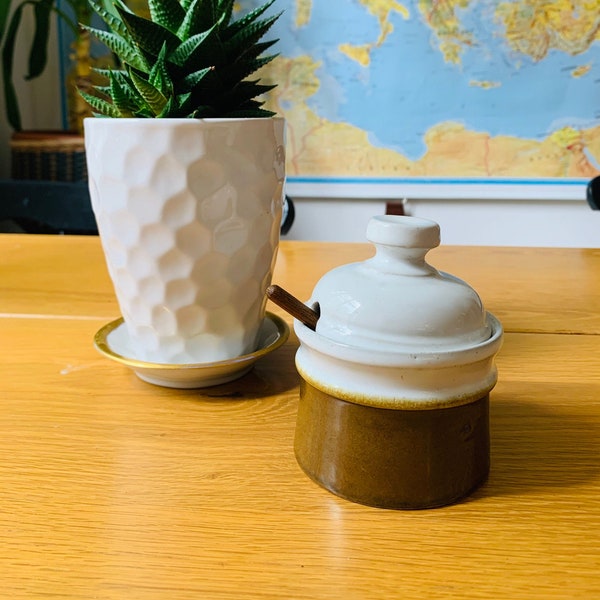
Locate an element on the screen. Image resolution: width=600 pixels, height=600 pixels. shallow dish is located at coordinates (229, 372).